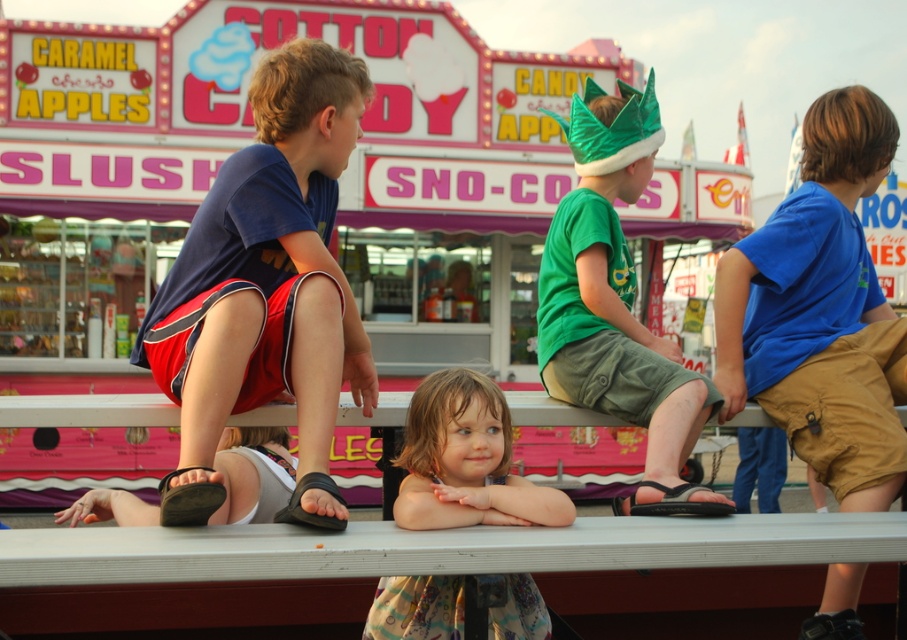
Question: Can you confirm if white plastic picnic table at center is positioned to the right of light brown hair at center?

Choices:
 (A) yes
 (B) no

Answer: (A)

Question: Can you confirm if white plastic picnic table at center is positioned above light brown hair at center?

Choices:
 (A) yes
 (B) no

Answer: (B)

Question: Which point appears closest to the camera in this image?

Choices:
 (A) (523, 580)
 (B) (262, 122)
 (C) (781, 588)

Answer: (A)

Question: Can you confirm if green shiny crown at center is thinner than light brown hair at center?

Choices:
 (A) yes
 (B) no

Answer: (B)

Question: Which point is farther to the camera?

Choices:
 (A) blue cotton shirt at right
 (B) light brown hair at center
 (C) white plastic picnic table at center

Answer: (A)

Question: Among these points, which one is farthest from the camera?

Choices:
 (A) (650, 138)
 (B) (339, 170)
 (C) (139, 541)
 (D) (447, 579)

Answer: (A)